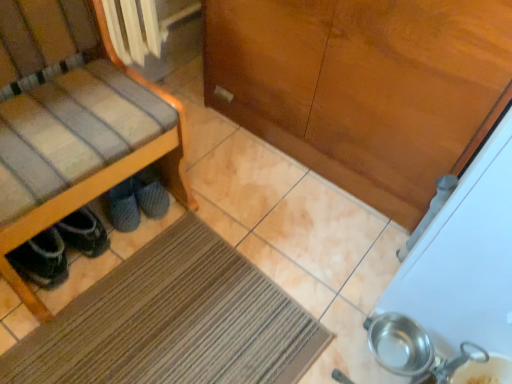
Identify the location of free location in front of gray fuzzy slippers at lower left, which is the 1th footwear in back-to-front order. (151, 249).